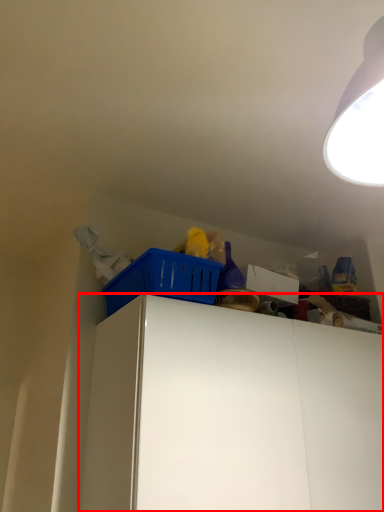
Question: Considering the relative positions of cabinetry (annotated by the red box) and basket in the image provided, where is cabinetry (annotated by the red box) located with respect to the staircase?

Choices:
 (A) left
 (B) right

Answer: (B)